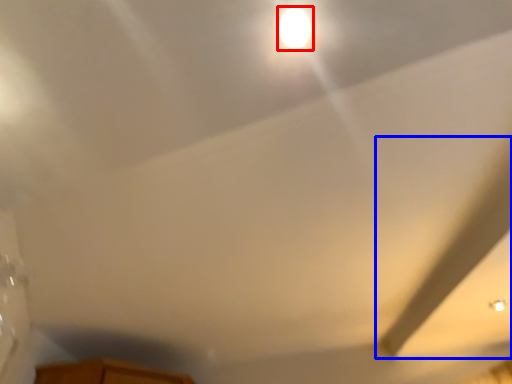
Question: Which of the following is the closest to the observer, light (highlighted by a red box) or exhaust hood (highlighted by a blue box)?

Choices:
 (A) light
 (B) exhaust hood

Answer: (A)